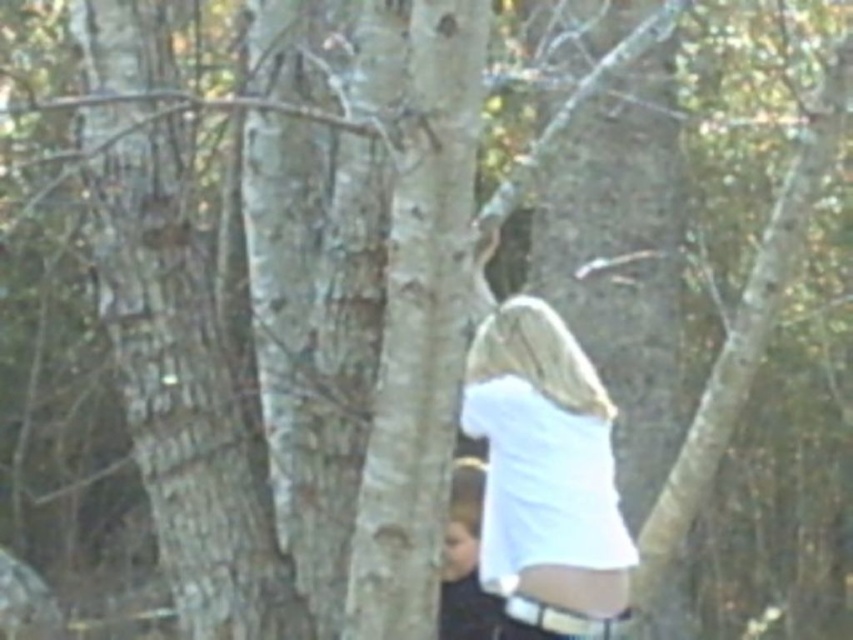
You are trying to take a photo of the white fabric at lower right but the white smooth tree trunk at center is blocking your view. Can you move to the left to get a clear shot?

The white smooth tree trunk at center is in front of the white fabric at lower right, so moving to the left might allow you to position yourself around the tree trunk and get a clear view of the white fabric at lower right.

You are a photographer trying to capture the white smooth tree trunk at center in a clear shot. Given the current blurry image, where should you focus your camera to ensure the trunk is sharp?

The white smooth tree trunk at center is located at point (181, 333), so focus your camera at that coordinate to ensure the trunk is sharp.

You are trying to take a photo of the white matte shirt at center but the white smooth tree trunk at center is blocking it. Can you move the tree trunk to the side to get a clear shot?

The white smooth tree trunk at center is a real object and cannot be moved, so you cannot move it to the side to get a clear shot of the white matte shirt at center.